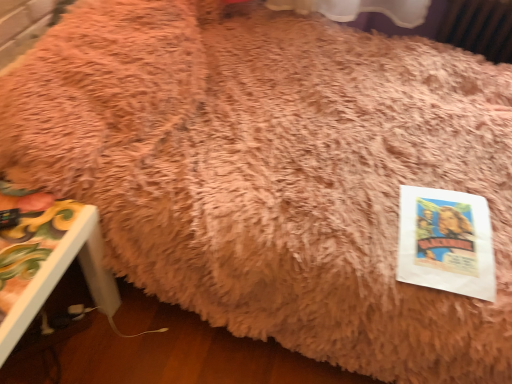
Question: Is white paper at lower right to the left or to the right of painted wood side table at lower left in the image?

Choices:
 (A) left
 (B) right

Answer: (B)

Question: Is white paper at lower right taller or shorter than painted wood side table at lower left?

Choices:
 (A) tall
 (B) short

Answer: (B)

Question: Considering the positions of white paper at lower right and painted wood side table at lower left in the image, is white paper at lower right bigger or smaller than painted wood side table at lower left?

Choices:
 (A) big
 (B) small

Answer: (B)

Question: Is painted wood side table at lower left spatially inside white paper at lower right, or outside of it?

Choices:
 (A) outside
 (B) inside

Answer: (A)

Question: Considering the positions of painted wood side table at lower left and white paper at lower right in the image, is painted wood side table at lower left bigger or smaller than white paper at lower right?

Choices:
 (A) small
 (B) big

Answer: (B)

Question: Relative to white paper at lower right, is painted wood side table at lower left in front or behind?

Choices:
 (A) front
 (B) behind

Answer: (A)

Question: Considering the positions of point (15, 283) and point (422, 225), is point (15, 283) closer or farther from the camera than point (422, 225)?

Choices:
 (A) closer
 (B) farther

Answer: (A)